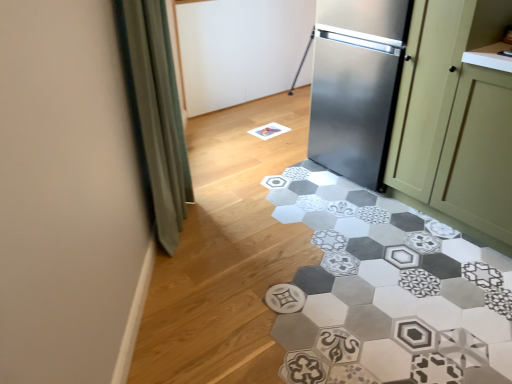
Identify the location of vacant space to the left of green matte cabinet at right. The width and height of the screenshot is (512, 384). [393, 234].